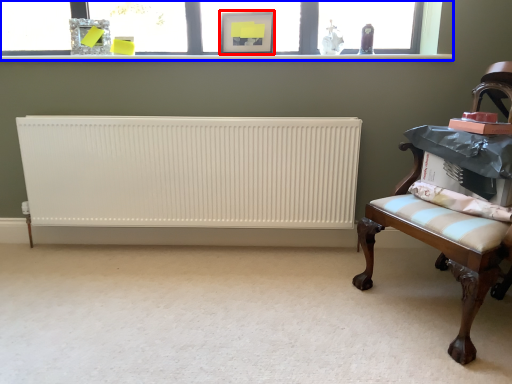
Question: Which object appears closest to the camera in this image, picture frame (highlighted by a red box) or window (highlighted by a blue box)?

Choices:
 (A) picture frame
 (B) window

Answer: (A)